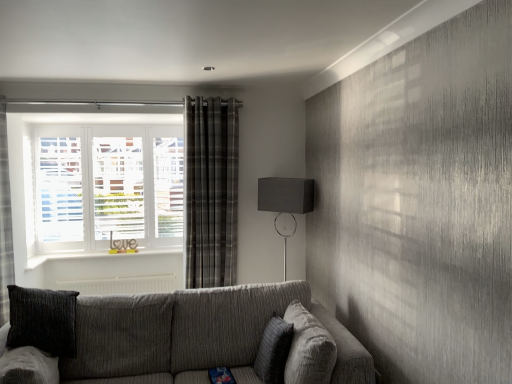
Locate an element on the screen. The image size is (512, 384). matte black lampshade at upper right is located at coordinates (286, 195).

The width and height of the screenshot is (512, 384). What do you see at coordinates (200, 339) in the screenshot?
I see `textured gray couch at lower center` at bounding box center [200, 339].

What do you see at coordinates (273, 350) in the screenshot? The height and width of the screenshot is (384, 512). I see `textured gray pillow at center` at bounding box center [273, 350].

Find the location of a particular element. plaid fabric curtain at center is located at coordinates [x=211, y=191].

Does textured gray pillow at center lie behind matte black lampshade at upper right?

No.

From the image's perspective, is textured gray pillow at center on matte black lampshade at upper right?

Incorrect, from the image's perspective, textured gray pillow at center is lower than matte black lampshade at upper right.

Can you tell me how much textured gray pillow at center and matte black lampshade at upper right differ in facing direction?

The angular difference between textured gray pillow at center and matte black lampshade at upper right is 49.4 degrees.

Between textured gray pillow at center and matte black lampshade at upper right, which one has larger width?

matte black lampshade at upper right.

Image resolution: width=512 pixels, height=384 pixels. I want to click on curtain on the right of metallic curtain rod at upper center, so click(x=211, y=191).

In the scene shown: From a real-world perspective, between plaid fabric curtain at center and metallic curtain rod at upper center, who is vertically higher?

In real-world perspective, metallic curtain rod at upper center is above.

In the scene shown: Does plaid fabric curtain at center have a lesser height compared to metallic curtain rod at upper center?

No.

From a real-world perspective, is matte black lampshade at upper right under plaid fabric curtain at center?

Indeed, from a real-world perspective, matte black lampshade at upper right is positioned beneath plaid fabric curtain at center.

Based on the photo, is matte black lampshade at upper right at the left side of plaid fabric curtain at center?

Incorrect, matte black lampshade at upper right is not on the left side of plaid fabric curtain at center.

Is plaid fabric curtain at center a part of matte black lampshade at upper right?

No, matte black lampshade at upper right does not contain plaid fabric curtain at center.

In terms of height, does matte black lampshade at upper right look taller or shorter compared to plaid fabric curtain at center?

Considering their sizes, matte black lampshade at upper right has less height than plaid fabric curtain at center.

Where is `beam above the matte black lampshade at upper right (from the image's perspective)`? This screenshot has height=384, width=512. beam above the matte black lampshade at upper right (from the image's perspective) is located at coordinates (93, 103).

Which is correct: matte black lampshade at upper right is inside metallic curtain rod at upper center, or outside of it?

matte black lampshade at upper right exists outside the volume of metallic curtain rod at upper center.

Is matte black lampshade at upper right looking in the opposite direction of metallic curtain rod at upper center?

That's not correct — matte black lampshade at upper right is not looking away from metallic curtain rod at upper center.

How different are the orientations of matte black lampshade at upper right and metallic curtain rod at upper center in degrees?

There is a 38.8-degree angle between the facing directions of matte black lampshade at upper right and metallic curtain rod at upper center.

Do you think matte black lampshade at upper right is within textured gray couch at lower center, or outside of it?

matte black lampshade at upper right is not enclosed by textured gray couch at lower center.

Is point (296, 211) more distant than point (213, 334)?

That is True.

Between matte black lampshade at upper right and textured gray couch at lower center, which one appears on the left side from the viewer's perspective?

From the viewer's perspective, textured gray couch at lower center appears more on the left side.

Considering the sizes of objects matte black lampshade at upper right and textured gray couch at lower center in the image provided, who is taller, matte black lampshade at upper right or textured gray couch at lower center?

Standing taller between the two is matte black lampshade at upper right.

Which of these two, textured gray pillow at center or textured gray couch at lower center, stands taller?

Standing taller between the two is textured gray couch at lower center.

Which of these two, textured gray pillow at center or textured gray couch at lower center, is thinner?

textured gray pillow at center.

Considering the positions of point (260, 371) and point (120, 358), is point (260, 371) closer or farther from the camera than point (120, 358)?

Point (260, 371) appears to be closer to the viewer than point (120, 358).

In order to click on studio couch located underneath the textured gray pillow at center (from a real-world perspective) in this screenshot , I will do `click(200, 339)`.

From a real-world perspective, is textured gray pillow at center beneath plaid fabric curtain at center?

Yes, from a real-world perspective, textured gray pillow at center is under plaid fabric curtain at center.

Which is behind, point (258, 376) or point (208, 172)?

The point (208, 172) is behind.

Locate an element on the screen. curtain behind the textured gray pillow at center is located at coordinates (211, 191).

Is textured gray pillow at center facing towards plaid fabric curtain at center?

No, textured gray pillow at center is not aimed at plaid fabric curtain at center.

Where is `pillow located in front of the matte black lampshade at upper right`? This screenshot has width=512, height=384. pillow located in front of the matte black lampshade at upper right is located at coordinates (273, 350).

In order to click on beam above the plaid fabric curtain at center (from the image's perspective) in this screenshot , I will do `click(93, 103)`.

Which object lies further to the anchor point plaid fabric curtain at center, textured gray pillow at center or matte black lampshade at upper right?

textured gray pillow at center.

Based on their spatial positions, is plaid fabric curtain at center or textured gray pillow at center closer to textured gray couch at lower center?

Among the two, textured gray pillow at center is located nearer to textured gray couch at lower center.

Based on their spatial positions, is matte black lampshade at upper right or textured gray couch at lower center closer to textured gray pillow at center?

Based on the image, textured gray couch at lower center appears to be nearer to textured gray pillow at center.

When comparing their distances from matte black lampshade at upper right, does textured gray couch at lower center or plaid fabric curtain at center seem further?

Based on the image, textured gray couch at lower center appears to be further to matte black lampshade at upper right.

Based on the photo, when comparing their distances from textured gray pillow at center, does matte black lampshade at upper right or plaid fabric curtain at center seem further?

The object further to textured gray pillow at center is plaid fabric curtain at center.

Which object lies nearer to the anchor point metallic curtain rod at upper center, matte black lampshade at upper right or textured gray pillow at center?

matte black lampshade at upper right lies closer to metallic curtain rod at upper center than the other object.

Looking at the image, which one is located closer to textured gray couch at lower center, metallic curtain rod at upper center or plaid fabric curtain at center?

Among the two, plaid fabric curtain at center is located nearer to textured gray couch at lower center.

Based on their spatial positions, is textured gray pillow at center or textured gray couch at lower center further from metallic curtain rod at upper center?

textured gray pillow at center is positioned further to the anchor metallic curtain rod at upper center.

Where is `table lamp between metallic curtain rod at upper center and textured gray couch at lower center in the up-down direction`? table lamp between metallic curtain rod at upper center and textured gray couch at lower center in the up-down direction is located at coordinates (286, 195).

Find the location of a particular element. The image size is (512, 384). pillow between textured gray couch at lower center and plaid fabric curtain at center in the front-back direction is located at coordinates (273, 350).

At what (x,y) coordinates should I click in order to perform the action: click on table lamp between textured gray couch at lower center and plaid fabric curtain at center in the front-back direction. Please return your answer as a coordinate pair (x, y). Looking at the image, I should click on (286, 195).

What are the coordinates of `pillow between textured gray couch at lower center and matte black lampshade at upper right in the front-back direction` in the screenshot? It's located at (273, 350).